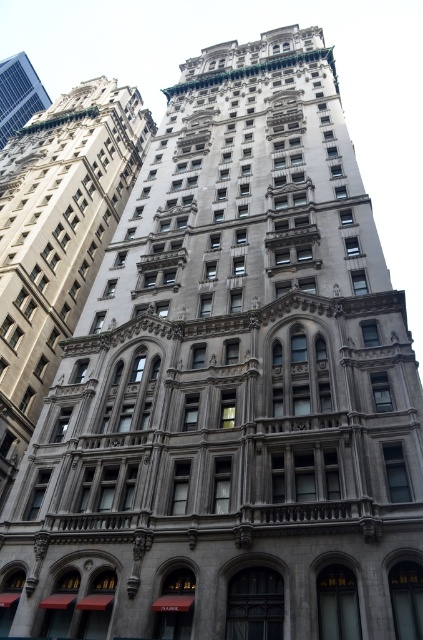
Is point (107, 218) in front of point (16, 74)?

Yes, it is in front of point (16, 74).

Between silver metallic building at center and metallic solar panel at upper left, which one is positioned lower?

silver metallic building at center is lower down.

Measure the distance between silver metallic building at center and camera.

They are 50.77 meters apart.

The image size is (423, 640). In order to click on silver metallic building at center in this screenshot , I will do `click(57, 236)`.